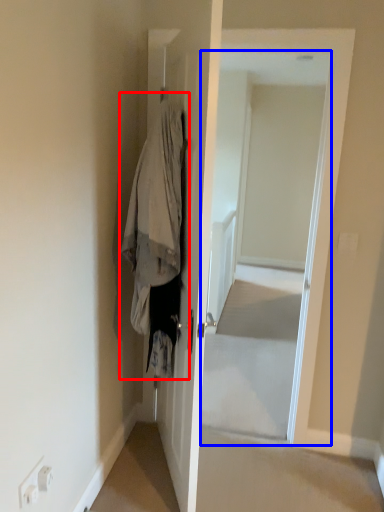
Question: Among these objects, which one is nearest to the camera, clothing (highlighted by a red box) or screen door (highlighted by a blue box)?

Choices:
 (A) clothing
 (B) screen door

Answer: (A)